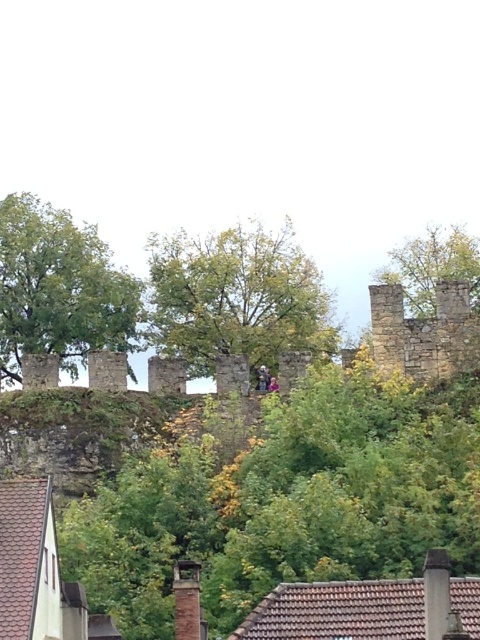
Is stone wall at upper center in front of green leafy tree at upper right?

Yes, it is in front of green leafy tree at upper right.

How far apart are stone wall at upper center and green leafy tree at upper right?

A distance of 24.29 meters exists between stone wall at upper center and green leafy tree at upper right.

Who is more forward, [436,330] or [432,272]?

Point [436,330] is in front.

Where is `stone wall at upper center`? stone wall at upper center is located at coordinates (86, 419).

Between green leafy tree at center and green leafy tree at upper center, which one is positioned lower?

green leafy tree at center

Which is more to the left, green leafy tree at center or green leafy tree at upper center?

green leafy tree at upper center

Which is in front, point (176, 282) or point (87, 268)?

Point (176, 282) is in front.

At what (x,y) coordinates should I click in order to perform the action: click on green leafy tree at center. Please return your answer as a coordinate pair (x, y). The width and height of the screenshot is (480, 640). Looking at the image, I should click on (236, 298).

Does stone wall at upper center appear on the left side of green leafy tree at upper center?

In fact, stone wall at upper center is to the right of green leafy tree at upper center.

Which is in front, point (282, 364) or point (78, 307)?

Point (282, 364)

Locate an element on the screen. stone wall at upper center is located at coordinates (86, 419).